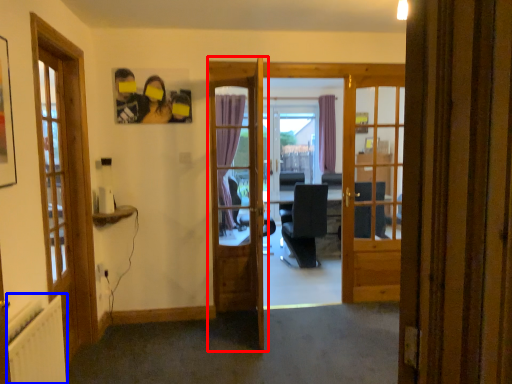
Question: Which object is further to the camera taking this photo, door (highlighted by a red box) or radiator (highlighted by a blue box)?

Choices:
 (A) door
 (B) radiator

Answer: (A)